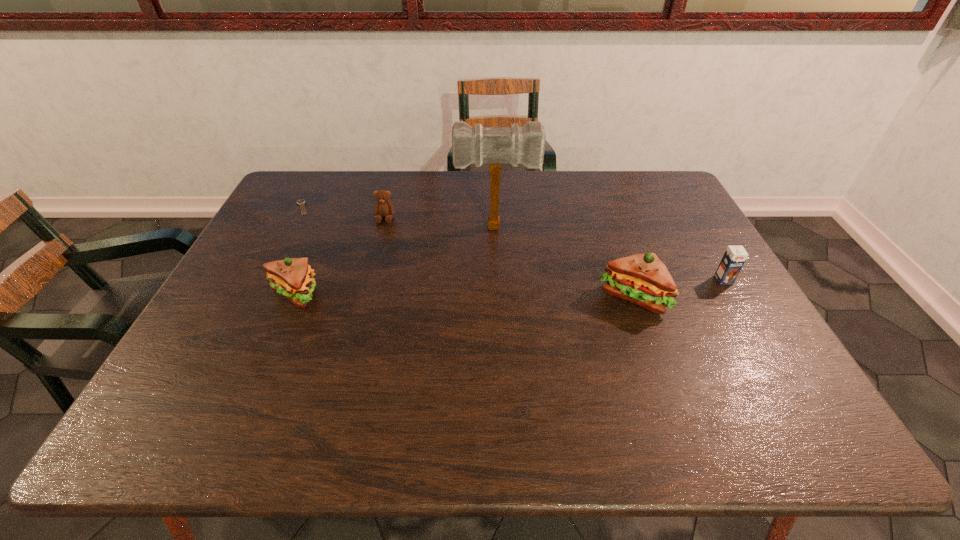
Find the location of a particular element. The height and width of the screenshot is (540, 960). vacant position for inserting another sandwich evenly is located at coordinates (463, 296).